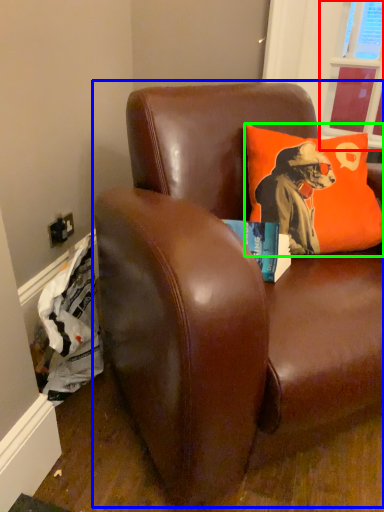
Question: Estimate the real-world distances between objects in this image. Which object is farther from window screen (highlighted by a red box), studio couch (highlighted by a blue box) or pillow (highlighted by a green box)?

Choices:
 (A) studio couch
 (B) pillow

Answer: (A)